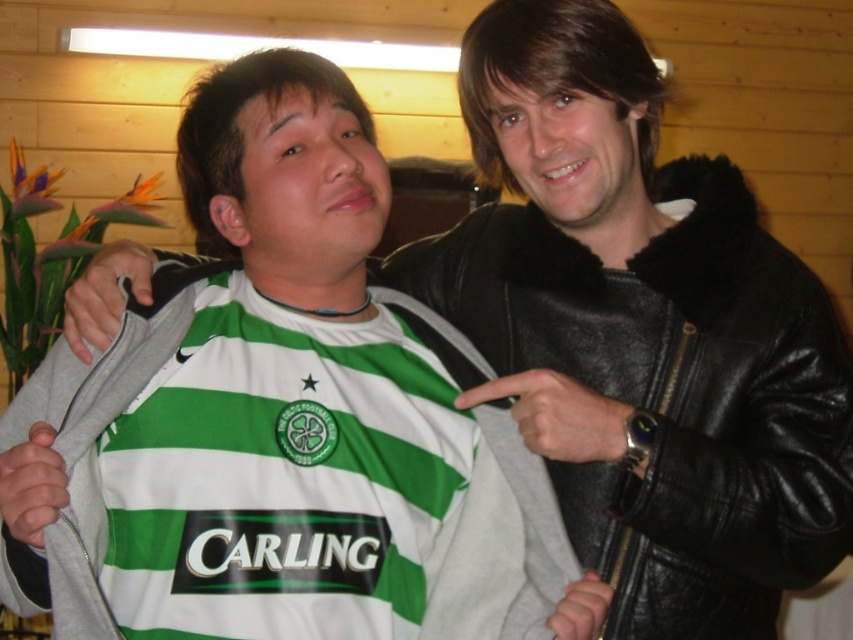
You are a photographer setting up a shoot in this room. You need to position a spotlight so that it illuminates both the black leather jacket at right and the gray fleece jacket at center without casting shadows on the background. Which jacket should you place closer to the spotlight to achieve this?

The black leather jacket at right should be placed closer to the spotlight because it is located above the gray fleece jacket at center, allowing the light to reach both without casting shadows on the background.

From the picture: You are standing in the room and want to hang the black leather jacket at right and the gray fleece jacket at center on a single coat rack. The coat rack has two hooks placed side by side. Which hook should you place each jacket on to match their positions in the image?

The black leather jacket at right should be placed on the right hook and the gray fleece jacket at center on the left hook to maintain their positions as shown in the image.